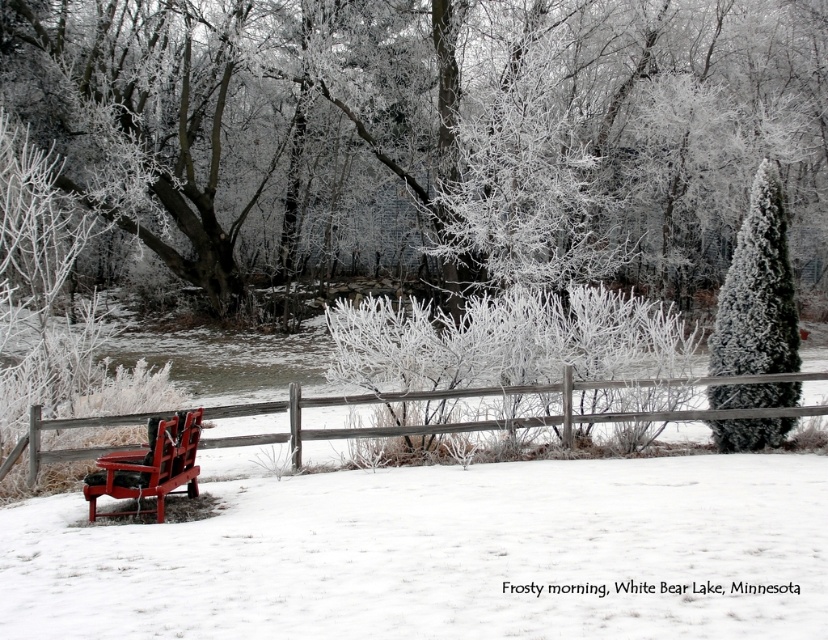
Question: Does wooden at left have a lesser width compared to green textured evergreen at right?

Choices:
 (A) no
 (B) yes

Answer: (A)

Question: Can you confirm if frosty branches at center is wider than wooden at left?

Choices:
 (A) no
 (B) yes

Answer: (B)

Question: Which point is closer to the camera?

Choices:
 (A) green textured evergreen at right
 (B) matte red park bench at lower left
 (C) frosty branches at center
 (D) wooden at left

Answer: (B)

Question: Which point is closer to the camera taking this photo?

Choices:
 (A) click(763, 381)
 (B) click(774, 333)

Answer: (A)

Question: Does frosty branches at center appear on the left side of green textured evergreen at right?

Choices:
 (A) yes
 (B) no

Answer: (A)

Question: Which point appears closest to the camera in this image?

Choices:
 (A) (778, 241)
 (B) (434, 392)

Answer: (B)